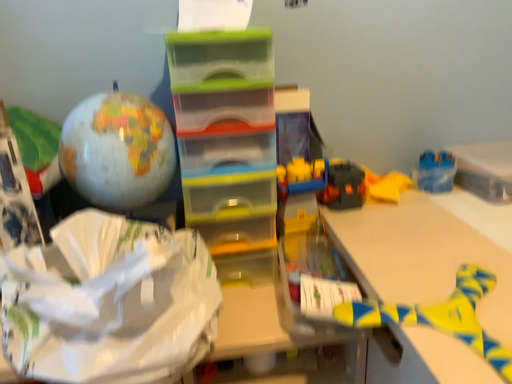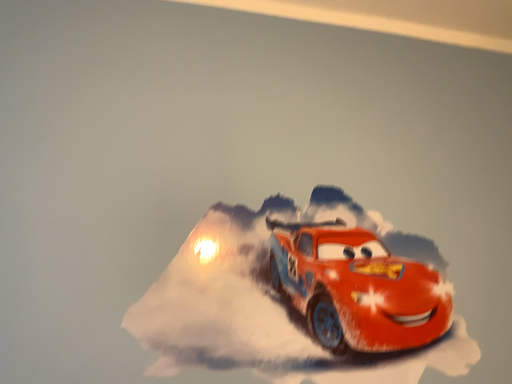
Question: Which way did the camera rotate in the video?

Choices:
 (A) rotated downward
 (B) rotated upward

Answer: (B)